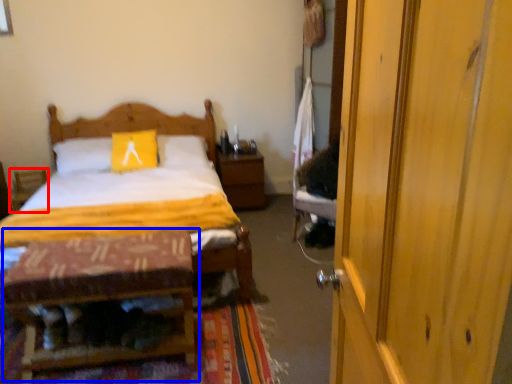
Question: Which object is further to the camera taking this photo, armchair (highlighted by a red box) or table (highlighted by a blue box)?

Choices:
 (A) armchair
 (B) table

Answer: (A)